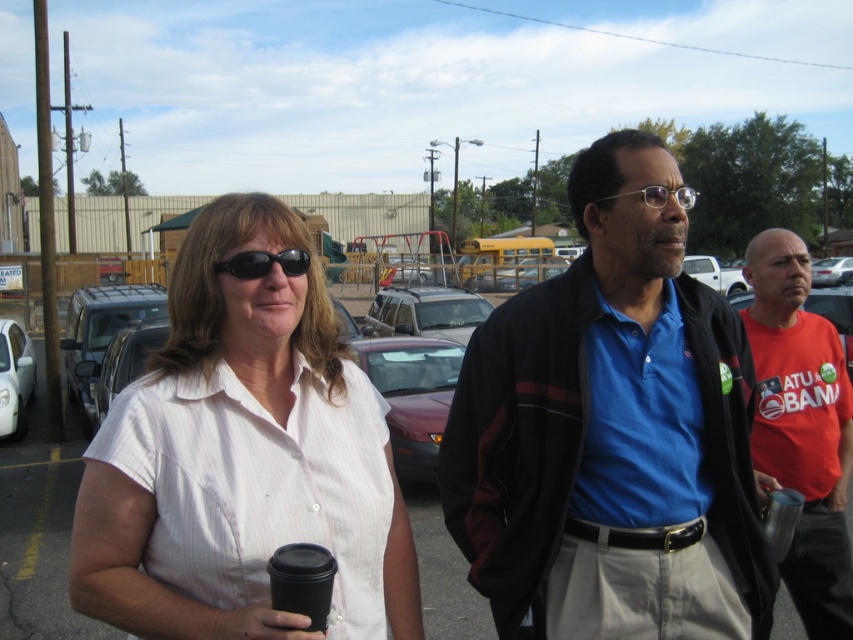
Question: Is gray asphalt parking lot at center behind metallic silver sedan at center?

Choices:
 (A) yes
 (B) no

Answer: (B)

Question: Which object is closer to the camera taking this photo?

Choices:
 (A) black plastic sunglasses at center
 (B) metallic gold glasses at center
 (C) white matte shirt at center
 (D) red cotton shirt at right

Answer: (C)

Question: Is the position of white matte shirt at center less distant than that of metallic silver cup at center-right?

Choices:
 (A) no
 (B) yes

Answer: (B)

Question: Which object is positioned closest to the satin red sedan at center?

Choices:
 (A) matte black suv at left
 (B) satin silver suv at center
 (C) blue cotton shirt at center
 (D) white matte car at left

Answer: (B)

Question: Among these objects, which one is nearest to the camera?

Choices:
 (A) white matte shirt at center
 (B) satin red sedan at center
 (C) white matte truck at center
 (D) metallic silver cup at center-right

Answer: (A)

Question: Can you confirm if satin silver suv at center is positioned below metallic silver sedan at center?

Choices:
 (A) no
 (B) yes

Answer: (B)